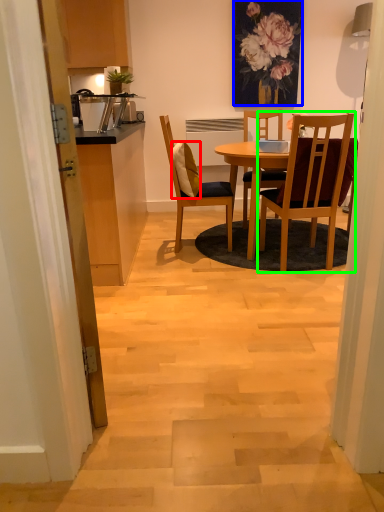
Question: Based on their relative distances, which object is farther from pillow (highlighted by a red box)? Choose from floral arrangement (highlighted by a blue box) and chair (highlighted by a green box).

Choices:
 (A) floral arrangement
 (B) chair

Answer: (A)